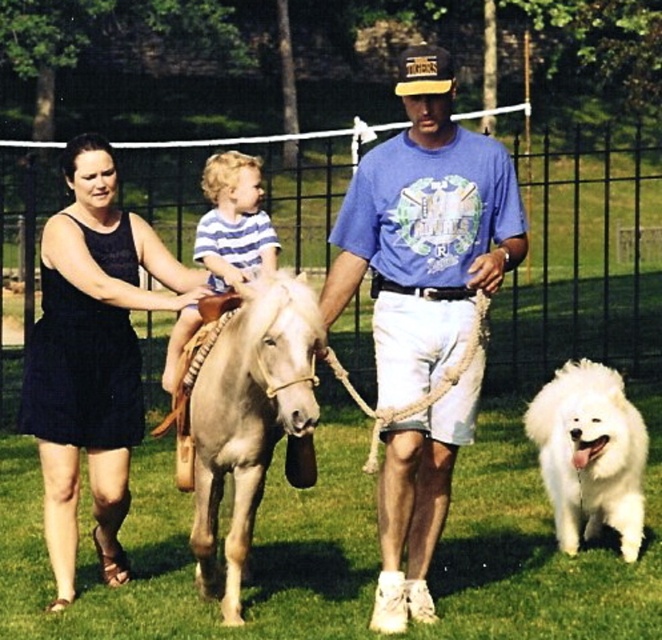
Does point (220, 484) come farther from viewer compared to point (201, 232)?

No, it is in front of (201, 232).

Between point (422, 323) and point (240, 250), which one is positioned behind?

The point (240, 250) is more distant.

At what (x,y) coordinates should I click in order to perform the action: click on white matte pony at center. Please return your answer as a coordinate pair (x, y). Looking at the image, I should click on (424, 232).

Does black lace dress at left have a smaller size compared to white fluffy dog at lower right?

No.

Which is in front, point (154, 246) or point (620, 385)?

Point (154, 246)

Between point (40, 372) and point (587, 417), which one is positioned behind?

The point (587, 417) is behind.

Find the location of a particular element. This screenshot has width=662, height=640. black lace dress at left is located at coordinates [x=91, y=356].

Is point (91, 240) in front of point (258, 372)?

No, (91, 240) is behind (258, 372).

Does black lace dress at left have a greater width compared to light gray leather saddle at center?

Correct, the width of black lace dress at left exceeds that of light gray leather saddle at center.

Locate an element on the screen. Image resolution: width=662 pixels, height=640 pixels. black lace dress at left is located at coordinates (91, 356).